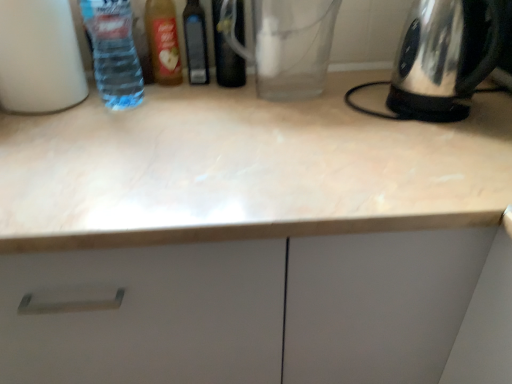
What do you see at coordinates (163, 41) in the screenshot? The width and height of the screenshot is (512, 384). I see `translucent glass bottle at center, which ranks as the third bottle in left-to-right order` at bounding box center [163, 41].

Measure the distance between transparent glass bottle at center, the fifth bottle when ordered from left to right, and camera.

They are 34.72 inches apart.

I want to click on translucent plastic bottle at upper left, which appears as the 4th bottle when viewed from the right, so click(x=113, y=52).

Measure the distance between point (5,57) and camera.

The distance of point (5,57) from camera is 76.10 centimeters.

At what (x,y) coordinates should I click in order to perform the action: click on translucent glass bottle at center, which ranks as the third bottle in left-to-right order. Please return your answer as a coordinate pair (x, y). The height and width of the screenshot is (384, 512). Looking at the image, I should click on (163, 41).

Considering the sizes of transparent glass coffee pot at center and white marble countertop at center in the image, is transparent glass coffee pot at center taller or shorter than white marble countertop at center?

In the image, transparent glass coffee pot at center appears to be shorter than white marble countertop at center.

Can you tell me how much transparent glass coffee pot at center and white marble countertop at center differ in facing direction?

transparent glass coffee pot at center and white marble countertop at center are facing 0.473 degrees away from each other.

Considering the points (298, 15) and (71, 184), which point is in front, point (298, 15) or point (71, 184)?

The point (71, 184) is more forward.

Is transparent glass coffee pot at center not close to white marble countertop at center?

transparent glass coffee pot at center is actually quite close to white marble countertop at center.

Which of these two, white marble countertop at center or white matte bottle at left, the 5th bottle positioned from the right, is wider?

white marble countertop at center is wider.

Is white marble countertop at center facing towards white matte bottle at left, the 1th bottle viewed from the left?

No, white marble countertop at center does not turn towards white matte bottle at left, the 1th bottle viewed from the left.

Is white marble countertop at center positioned before white matte bottle at left, the 5th bottle positioned from the right?

Yes, white marble countertop at center is closer to the viewer.

Can you tell me how much stainless steel kettle at right and translucent plastic bottle at upper left, which appears as the 4th bottle when viewed from the right, differ in facing direction?

They differ by 0.00022 degrees in their facing directions.

Based on the photo, can you confirm if stainless steel kettle at right is positioned to the right of translucent plastic bottle at upper left, positioned as the 2th bottle in left-to-right order?

Correct, you'll find stainless steel kettle at right to the right of translucent plastic bottle at upper left, positioned as the 2th bottle in left-to-right order.

Is stainless steel kettle at right positioned beyond the bounds of translucent plastic bottle at upper left, which appears as the 4th bottle when viewed from the right?

stainless steel kettle at right lies outside translucent plastic bottle at upper left, which appears as the 4th bottle when viewed from the right,'s area.

Is stainless steel kettle at right directly adjacent to translucent plastic bottle at upper left, positioned as the 2th bottle in left-to-right order?

No, stainless steel kettle at right is not making contact with translucent plastic bottle at upper left, positioned as the 2th bottle in left-to-right order.

Is transparent glass bottle at center, the fifth bottle when ordered from left to right, positioned far away from stainless steel kettle at right?

Actually, transparent glass bottle at center, the fifth bottle when ordered from left to right, and stainless steel kettle at right are a little close together.

Considering the relative sizes of transparent glass bottle at center, marked as the first bottle in a right-to-left arrangement, and stainless steel kettle at right in the image provided, is transparent glass bottle at center, marked as the first bottle in a right-to-left arrangement, taller than stainless steel kettle at right?

Yes, transparent glass bottle at center, marked as the first bottle in a right-to-left arrangement, is taller than stainless steel kettle at right.

From the image's perspective, does transparent glass bottle at center, the fifth bottle when ordered from left to right, appear lower than stainless steel kettle at right?

No, from the image's perspective, transparent glass bottle at center, the fifth bottle when ordered from left to right, is not below stainless steel kettle at right.

Looking at this image, does transparent glass bottle at center, marked as the first bottle in a right-to-left arrangement, turn towards stainless steel kettle at right?

No, transparent glass bottle at center, marked as the first bottle in a right-to-left arrangement, is not oriented towards stainless steel kettle at right.

Does point (492, 35) appear closer or farther from the camera than point (317, 86)?

Point (492, 35).

Are stainless steel kettle at right and transparent glass coffee pot at center making contact?

They are not placed beside each other.

Is the depth of stainless steel kettle at right less than that of transparent glass coffee pot at center?

Yes, it is in front of transparent glass coffee pot at center.

From the image's perspective, who appears lower, stainless steel kettle at right or transparent glass coffee pot at center?

stainless steel kettle at right appears lower in the image.

Is translucent glass bottle at center, which ranks as the third bottle in left-to-right order, placed right next to transparent glass bottle at center, the fifth bottle when ordered from left to right?

There is a gap between translucent glass bottle at center, which ranks as the third bottle in left-to-right order, and transparent glass bottle at center, the fifth bottle when ordered from left to right.

Looking at this image, which of these two, translucent glass bottle at center, which ranks as the third bottle in left-to-right order, or transparent glass bottle at center, the fifth bottle when ordered from left to right, stands shorter?

With less height is translucent glass bottle at center, which ranks as the third bottle in left-to-right order.

From a real-world perspective, is translucent glass bottle at center, which ranks as the third bottle in left-to-right order, located beneath transparent glass bottle at center, marked as the first bottle in a right-to-left arrangement?

Yes, from a real-world perspective, translucent glass bottle at center, which ranks as the third bottle in left-to-right order, is below transparent glass bottle at center, marked as the first bottle in a right-to-left arrangement.

Which of these two, translucent glass bottle at center, the third bottle viewed from the right, or transparent glass bottle at center, marked as the first bottle in a right-to-left arrangement, is thinner?

translucent glass bottle at center, the third bottle viewed from the right.

Which is behind, point (206, 56) or point (86, 102)?

The point (206, 56) is behind.

Consider the image. From a real-world perspective, is black plastic bottle at center, which is the 4th bottle from left to right, positioned above or below white marble countertop at center?

From a real-world perspective, black plastic bottle at center, which is the 4th bottle from left to right, is physically above white marble countertop at center.

Could you measure the distance between black plastic bottle at center, which is the 4th bottle from left to right, and white marble countertop at center?

They are 15.86 inches apart.

Consider the image. Is black plastic bottle at center, the second bottle from the right, taller than white marble countertop at center?

No, black plastic bottle at center, the second bottle from the right, is not taller than white marble countertop at center.

The image size is (512, 384). In order to click on coffeepot that appears above the white marble countertop at center (from a real-world perspective) in this screenshot , I will do `click(286, 44)`.

Find the location of a particular element. the 1st bottle positioned above the white marble countertop at center (from the image's perspective) is located at coordinates (39, 57).

Which object lies nearer to the anchor point translucent plastic bottle at upper left, which appears as the 4th bottle when viewed from the right, stainless steel kettle at right or white marble countertop at center?

Based on the image, white marble countertop at center appears to be nearer to translucent plastic bottle at upper left, which appears as the 4th bottle when viewed from the right.

From the image, which object appears to be farther from black plastic bottle at center, the second bottle from the right, translucent plastic bottle at upper left, positioned as the 2th bottle in left-to-right order, or stainless steel kettle at right?

stainless steel kettle at right is further to black plastic bottle at center, the second bottle from the right.

Considering their positions, is transparent glass bottle at center, marked as the first bottle in a right-to-left arrangement, positioned closer to translucent plastic bottle at upper left, positioned as the 2th bottle in left-to-right order, than white matte bottle at left, the 1th bottle viewed from the left?

white matte bottle at left, the 1th bottle viewed from the left, lies closer to translucent plastic bottle at upper left, positioned as the 2th bottle in left-to-right order, than the other object.

From the image, which object appears to be farther from translucent glass bottle at center, the third bottle viewed from the right, white matte bottle at left, the 1th bottle viewed from the left, or stainless steel kettle at right?

Among the two, stainless steel kettle at right is located further to translucent glass bottle at center, the third bottle viewed from the right.

Consider the image. When comparing their distances from translucent glass bottle at center, the third bottle viewed from the right, does transparent glass bottle at center, marked as the first bottle in a right-to-left arrangement, or black plastic bottle at center, the second bottle from the right, seem further?

transparent glass bottle at center, marked as the first bottle in a right-to-left arrangement.

Considering their positions, is translucent glass bottle at center, the third bottle viewed from the right, positioned further to white matte bottle at left, the 1th bottle viewed from the left, than translucent plastic bottle at upper left, which appears as the 4th bottle when viewed from the right?

Based on the image, translucent glass bottle at center, the third bottle viewed from the right, appears to be further to white matte bottle at left, the 1th bottle viewed from the left.

From the image, which object appears to be farther from white matte bottle at left, the 5th bottle positioned from the right, black plastic bottle at center, the second bottle from the right, or transparent glass coffee pot at center?

Based on the image, transparent glass coffee pot at center appears to be further to white matte bottle at left, the 5th bottle positioned from the right.

Which object lies nearer to the anchor point transparent glass bottle at center, marked as the first bottle in a right-to-left arrangement, stainless steel kettle at right or white marble countertop at center?

white marble countertop at center.

At what (x,y) coordinates should I click in order to perform the action: click on bottle between white matte bottle at left, the 5th bottle positioned from the right, and translucent glass bottle at center, the third bottle viewed from the right, in the horizontal direction. Please return your answer as a coordinate pair (x, y). The image size is (512, 384). Looking at the image, I should click on (113, 52).

At what (x,y) coordinates should I click in order to perform the action: click on coffeepot between transparent glass bottle at center, marked as the first bottle in a right-to-left arrangement, and stainless steel kettle at right. Please return your answer as a coordinate pair (x, y). Looking at the image, I should click on (286, 44).

Locate an element on the screen. Image resolution: width=512 pixels, height=384 pixels. coffeepot between translucent plastic bottle at upper left, positioned as the 2th bottle in left-to-right order, and stainless steel kettle at right, in the horizontal direction is located at coordinates (286, 44).

This screenshot has width=512, height=384. I want to click on coffeepot between translucent glass bottle at center, which ranks as the third bottle in left-to-right order, and stainless steel kettle at right from left to right, so pos(286,44).